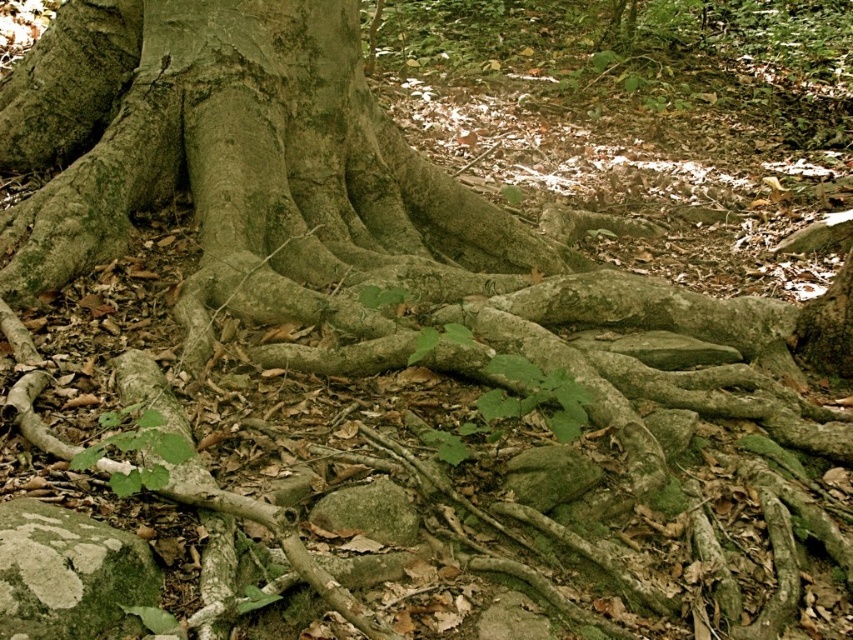
You are a hiker trying to navigate through the forest and need to step over the green mossy rock at lower left and the green mossy rock at center. Which rock should you step over first based on their positions?

You should step over the green mossy rock at lower left first because it is positioned below the green mossy rock at center, meaning it is closer to your current position.

From the picture: You are a hiker who wants to step on the green mossy rock at lower left and the green mossy rock at center. Which one is closer to you?

The green mossy rock at lower left is closer to you because it is in front of the green mossy rock at center.